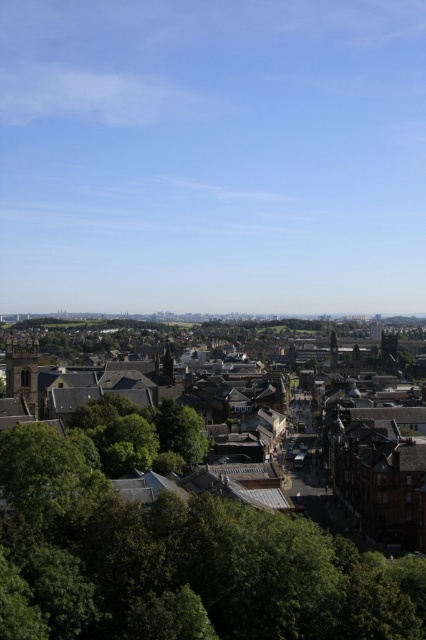
The image size is (426, 640). In order to click on brown stone buildings at center in this screenshot , I will do `click(379, 472)`.

Who is lower down, brown stone buildings at center or brown stone tower at center?

brown stone buildings at center

Locate an element on the screen. The image size is (426, 640). brown stone buildings at center is located at coordinates (379, 472).

Where is `brown stone buildings at center`? brown stone buildings at center is located at coordinates (379, 472).

Is brown stone buildings at center further to the viewer compared to brown stone tower at left?

No.

Is point (397, 531) positioned after point (22, 378)?

No, (397, 531) is in front of (22, 378).

Locate an element on the screen. The image size is (426, 640). brown stone buildings at center is located at coordinates (379, 472).

Consider the image. Which is above, green leafy tree at lower left or brown stone buildings at center?

green leafy tree at lower left is above.

Does point (31, 552) come farther from viewer compared to point (175, 433)?

That is False.

Find the location of a particular element. Image resolution: width=426 pixels, height=640 pixels. green leafy tree at lower left is located at coordinates (178, 563).

Locate an element on the screen. green leafy tree at lower left is located at coordinates (178, 563).